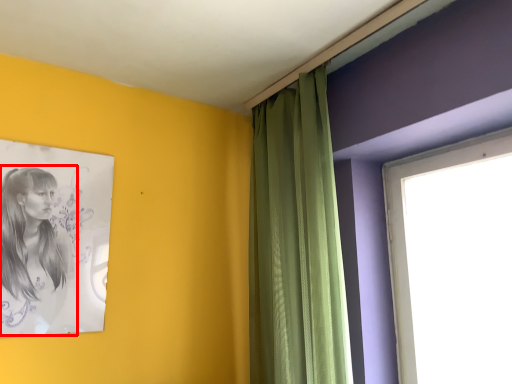
Question: Where is woman (annotated by the red box) located in relation to curtain in the image?

Choices:
 (A) right
 (B) left

Answer: (B)